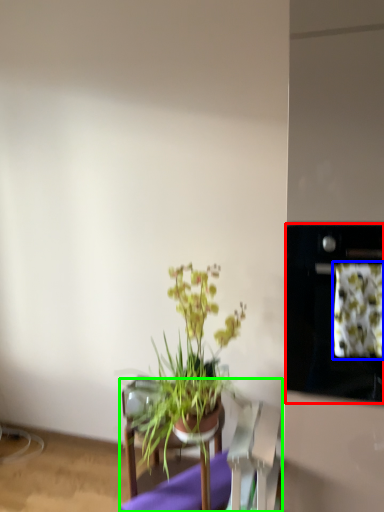
Question: Which object is the farthest from oven (highlighted by a red box)? Choose among these: flower (highlighted by a blue box) or furniture (highlighted by a green box).

Choices:
 (A) flower
 (B) furniture

Answer: (B)